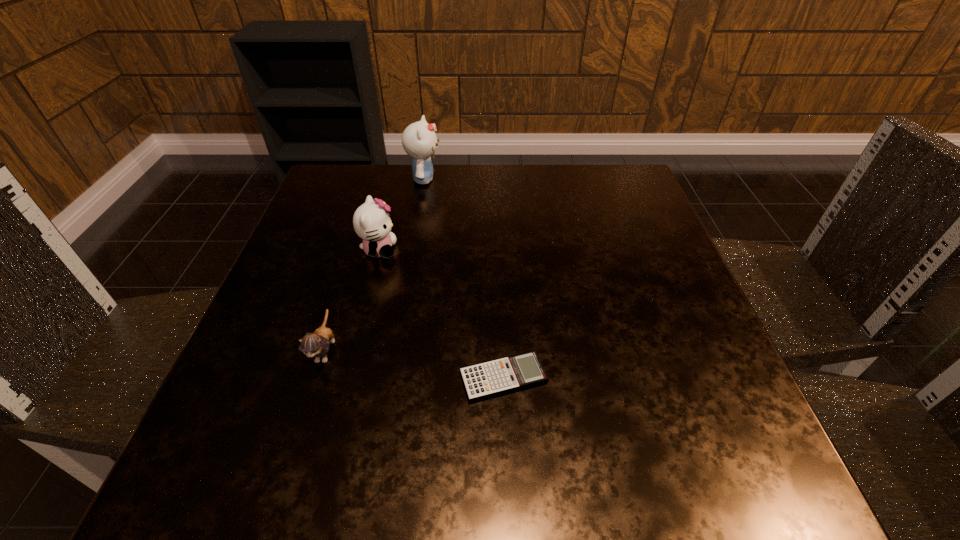
You are a GUI agent. You are given a task and a screenshot of the screen. Output one action in this format:
    pyautogui.click(x=<x>, y=<y>)
    Task: Click on the free space that satisfies the following two spatial constraints: 1. on the front-facing side of the second tallest object; 2. on the front-facing side of the nearest kitten
    Image resolution: width=960 pixels, height=540 pixels.
    Given the screenshot: What is the action you would take?
    pyautogui.click(x=353, y=350)

Identify the location of vacant position in the image that satisfies the following two spatial constraints: 1. on the front-facing side of the third tallest object; 2. on the right side of the rightmost object. (317, 378).

Where is `free region that satisfies the following two spatial constraints: 1. on the front-facing side of the shortest kitten; 2. on the left side of the calculator`? The height and width of the screenshot is (540, 960). free region that satisfies the following two spatial constraints: 1. on the front-facing side of the shortest kitten; 2. on the left side of the calculator is located at coordinates (317, 378).

Locate an element on the screen. The image size is (960, 540). vacant position in the image that satisfies the following two spatial constraints: 1. on the front-facing side of the third shortest object; 2. on the right side of the rightmost object is located at coordinates (347, 378).

The image size is (960, 540). Find the location of `vacant space that satisfies the following two spatial constraints: 1. on the front-facing side of the farthest object; 2. on the left side of the rightmost object`. vacant space that satisfies the following two spatial constraints: 1. on the front-facing side of the farthest object; 2. on the left side of the rightmost object is located at coordinates (391, 378).

This screenshot has width=960, height=540. I want to click on vacant space that satisfies the following two spatial constraints: 1. on the front-facing side of the calculator; 2. on the left side of the second tallest kitten, so click(347, 378).

Where is `free point that satisfies the following two spatial constraints: 1. on the front-facing side of the farthest object; 2. on the left side of the calculator`? This screenshot has height=540, width=960. free point that satisfies the following two spatial constraints: 1. on the front-facing side of the farthest object; 2. on the left side of the calculator is located at coordinates (391, 378).